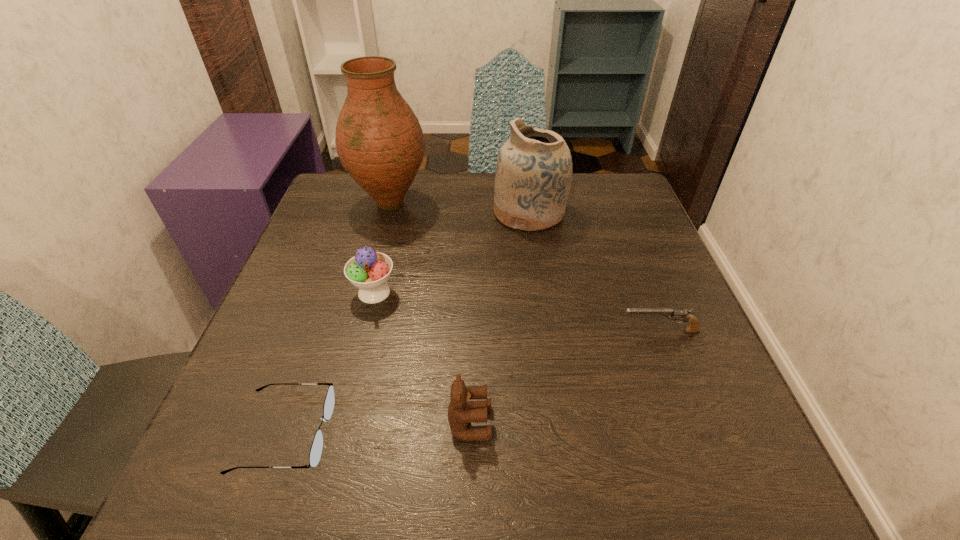
Where is `empty location between the fourth object from left to right and the fourth farthest object`? empty location between the fourth object from left to right and the fourth farthest object is located at coordinates (564, 377).

Identify the location of free spot between the second object from right to left and the icecream. The width and height of the screenshot is (960, 540). (452, 252).

I want to click on object that is the fourth closest one to the vase, so click(x=461, y=411).

Point out which object is positioned as the nearest to the fifth tallest object. Please provide its 2D coordinates. Your answer should be formatted as a tuple, i.e. [(x, y)], where the tuple contains the x and y coordinates of a point satisfying the conditions above.

[(461, 411)]